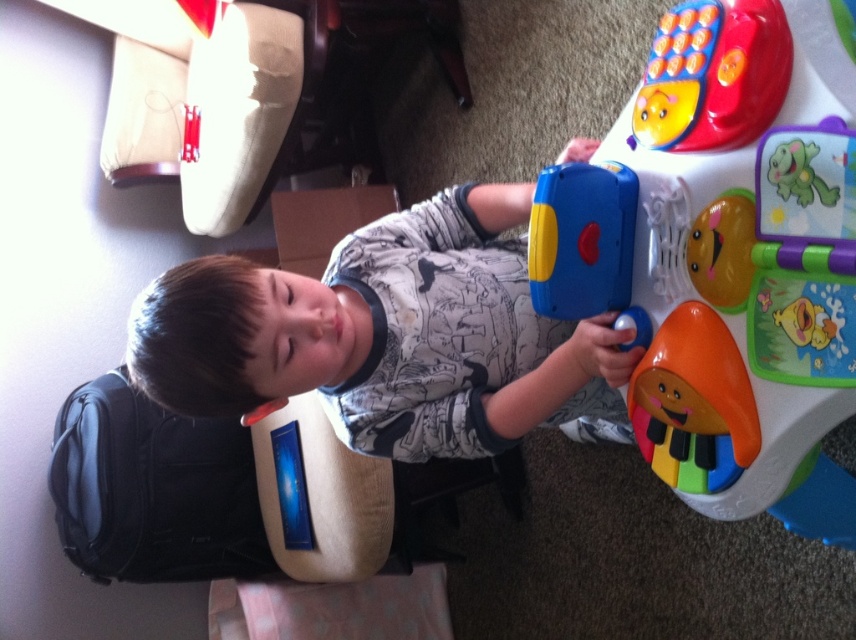
Is rubberized plastic toy at center right behind matte plastic child at center?

No, it is not.

Which is behind, point (712, 141) or point (461, 273)?

Point (461, 273)

Image resolution: width=856 pixels, height=640 pixels. What do you see at coordinates (726, 256) in the screenshot? I see `rubberized plastic toy at center right` at bounding box center [726, 256].

At what (x,y) coordinates should I click in order to perform the action: click on rubberized plastic toy at center right. Please return your answer as a coordinate pair (x, y). Looking at the image, I should click on (726, 256).